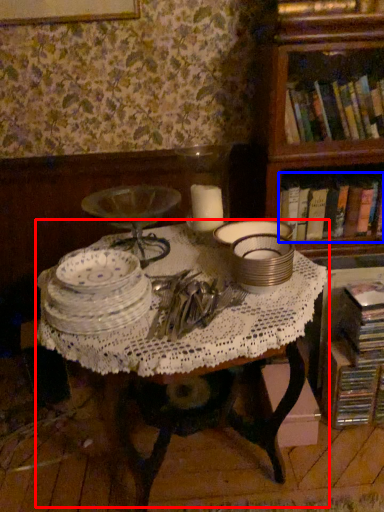
Question: Which object is further to the camera taking this photo, table (highlighted by a red box) or book (highlighted by a blue box)?

Choices:
 (A) table
 (B) book

Answer: (B)